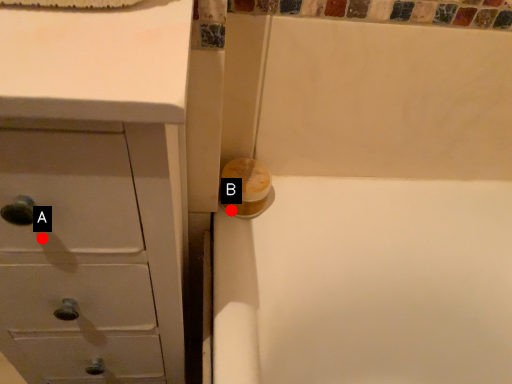
Question: Two points are circled on the image, labeled by A and B beside each circle. Which point is further to the camera?

Choices:
 (A) A is further
 (B) B is further

Answer: (B)